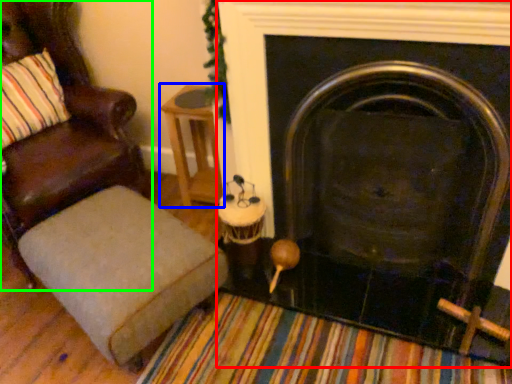
Question: Which object is positioned farthest from fireplace (highlighted by a red box)? Select from side table (highlighted by a blue box) and chair (highlighted by a green box).

Choices:
 (A) side table
 (B) chair

Answer: (B)